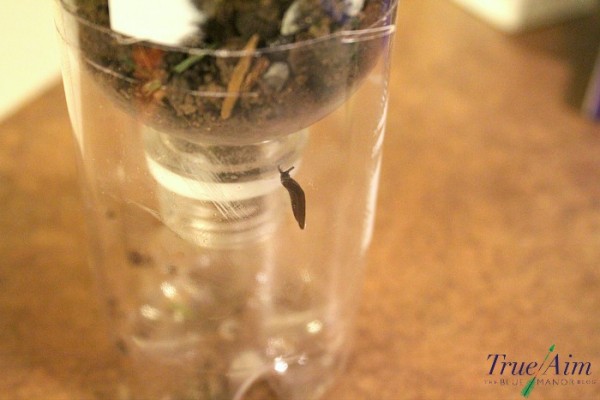
Locate an element on the screen. The image size is (600, 400). blurred brown table empty space is located at coordinates (434, 71), (521, 137), (399, 251), (554, 261), (416, 354), (49, 331), (35, 189).